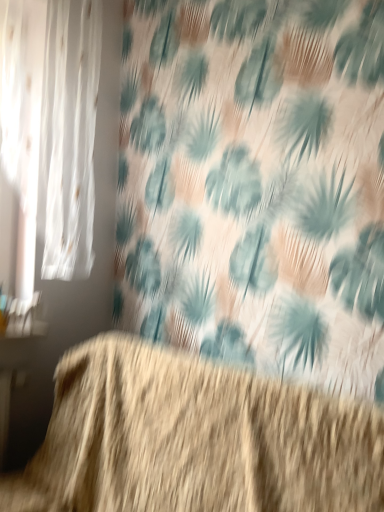
What is the approximate width of beige fabric bed at lower center?

32.36 inches.

This screenshot has height=512, width=384. What are the coordinates of `beige fabric bed at lower center` in the screenshot? It's located at (195, 440).

What do you see at coordinates (195, 440) in the screenshot? I see `beige fabric bed at lower center` at bounding box center [195, 440].

Locate an element on the screen. The height and width of the screenshot is (512, 384). beige fabric bed at lower center is located at coordinates (195, 440).